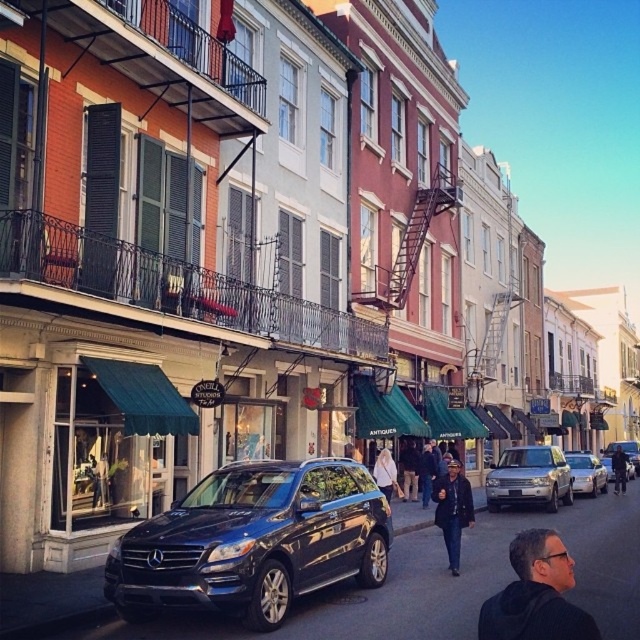
Question: Where is shiny dark blue suv at center located in relation to dark blue hoodie at lower right in the image?

Choices:
 (A) right
 (B) left

Answer: (B)

Question: Is shiny dark blue suv at center to the right of dark blue jeans at center from the viewer's perspective?

Choices:
 (A) no
 (B) yes

Answer: (A)

Question: Among these points, which one is farthest from the camera?

Choices:
 (A) (387, 476)
 (B) (371, 513)

Answer: (A)

Question: Does dark blue hoodie at lower right lie in front of silver metallic suv at center?

Choices:
 (A) yes
 (B) no

Answer: (A)

Question: Among these objects, which one is farthest from the camera?

Choices:
 (A) metallic silver suv at center
 (B) silver metallic suv at center

Answer: (A)

Question: Which object is closer to the camera taking this photo?

Choices:
 (A) white cotton jacket at center
 (B) shiny silver suv at center

Answer: (A)